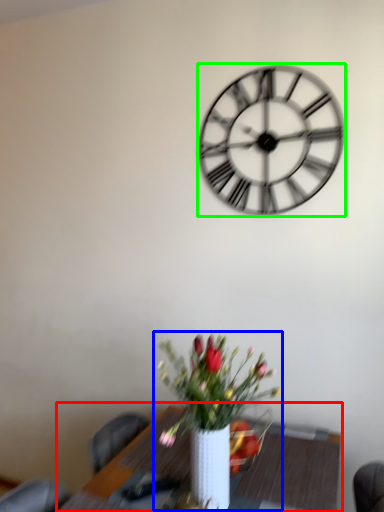
Question: Based on their relative distances, which object is nearer to table (highlighted by a red box)? Choose from houseplant (highlighted by a blue box) and wall clock (highlighted by a green box).

Choices:
 (A) houseplant
 (B) wall clock

Answer: (A)